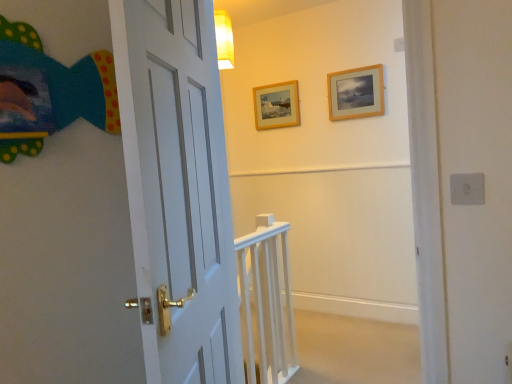
Question: Considering the relative sizes of white wooden rail at center and wooden picture frame at upper center, which is the 1th picture frame in left-to-right order, in the image provided, is white wooden rail at center wider than wooden picture frame at upper center, which is the 1th picture frame in left-to-right order,?

Choices:
 (A) no
 (B) yes

Answer: (B)

Question: Can you confirm if white wooden rail at center is positioned to the right of wooden picture frame at upper center, which is the 1th picture frame in left-to-right order?

Choices:
 (A) yes
 (B) no

Answer: (B)

Question: Is white wooden rail at center shorter than wooden picture frame at upper center, the second picture frame viewed from the right?

Choices:
 (A) yes
 (B) no

Answer: (B)

Question: From the image's perspective, does white wooden rail at center appear lower than wooden picture frame at upper center, positioned as the 2th picture frame in front-to-back order?

Choices:
 (A) yes
 (B) no

Answer: (A)

Question: From the image's perspective, is white wooden rail at center on top of wooden picture frame at upper center, the second picture frame viewed from the right?

Choices:
 (A) yes
 (B) no

Answer: (B)

Question: Looking at their shapes, would you say wooden picture frame at upper center, the second picture frame viewed from the right, is wider or thinner than wooden picture frame at upper center, marked as the first picture frame in a front-to-back arrangement?

Choices:
 (A) thin
 (B) wide

Answer: (A)

Question: From the image's perspective, relative to wooden picture frame at upper center, which is the 1th picture frame from right to left, is wooden picture frame at upper center, positioned as the 2th picture frame in front-to-back order, above or below?

Choices:
 (A) above
 (B) below

Answer: (B)

Question: From a real-world perspective, is wooden picture frame at upper center, which is the 1th picture frame in left-to-right order, positioned above or below wooden picture frame at upper center, marked as the first picture frame in a front-to-back arrangement?

Choices:
 (A) above
 (B) below

Answer: (B)

Question: Is point (256, 120) positioned closer to the camera than point (352, 77)?

Choices:
 (A) farther
 (B) closer

Answer: (A)

Question: Is white wooden rail at center spatially inside wooden picture frame at upper center, the second picture frame viewed from the right, or outside of it?

Choices:
 (A) inside
 (B) outside

Answer: (B)

Question: In the image, is white wooden rail at center positioned in front of or behind wooden picture frame at upper center, which is the 1th picture frame in left-to-right order?

Choices:
 (A) front
 (B) behind

Answer: (A)

Question: Is point (272, 253) positioned closer to the camera than point (272, 125)?

Choices:
 (A) farther
 (B) closer

Answer: (B)

Question: In terms of width, does white wooden rail at center look wider or thinner when compared to wooden picture frame at upper center, which is the 1th picture frame in left-to-right order?

Choices:
 (A) thin
 (B) wide

Answer: (B)

Question: Considering the positions of point (355, 84) and point (261, 86), is point (355, 84) closer or farther from the camera than point (261, 86)?

Choices:
 (A) closer
 (B) farther

Answer: (A)

Question: From a real-world perspective, is wooden picture frame at upper center, marked as the first picture frame in a front-to-back arrangement, above or below wooden picture frame at upper center, arranged as the first picture frame when viewed from the back?

Choices:
 (A) below
 (B) above

Answer: (B)